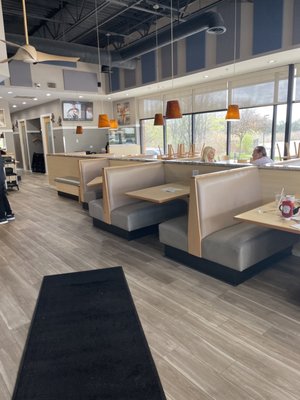
Locate an element on the screen. This screenshot has height=400, width=300. hanging lights is located at coordinates (238, 114), (173, 106), (157, 120), (113, 124), (101, 120), (78, 132).